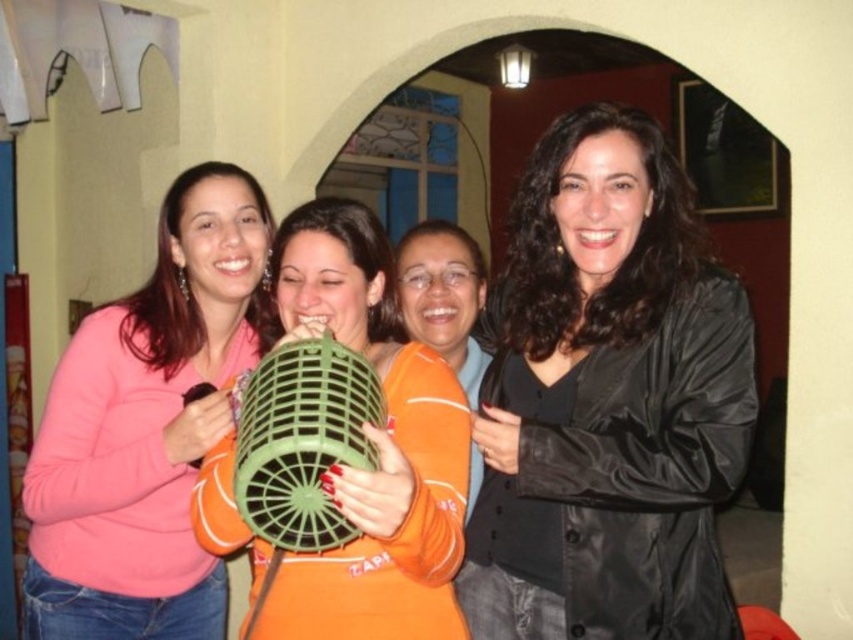
You are a photographer standing 5 feet away from the black shiny jacket at center. Can you reach it without moving your feet?

The black shiny jacket at center is 4.40 feet away from the camera, so yes, you can reach it without moving your feet since you are only 0.6 feet away from the jacket.

You are organizing a clothing rack and need to place the black shiny jacket at center and the pink matte sweater at left. Given their sizes, which one should you place first to maximize space efficiency?

The black shiny jacket at center occupies less space than the pink matte sweater at left, so place the pink matte sweater at left first to utilize the space effectively.

You are a photographer trying to capture a clear shot of the black shiny jacket at center and the orange fabric pillow at center. Which object should you focus on first to ensure it appears sharp in the photo?

The black shiny jacket at center is in front of the orange fabric pillow at center, so you should focus on the black shiny jacket at center first to ensure it appears sharp.